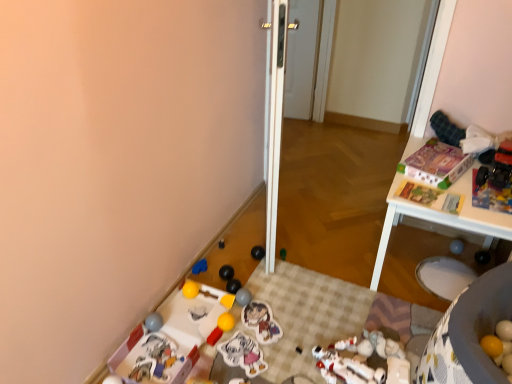
Question: From a real-world perspective, is matte gray ball at lower left, acting as the nineteenth toy starting from the right, positioned above or below yellow matte ball at lower right, the 17th toy positioned from the left?

Choices:
 (A) below
 (B) above

Answer: (A)

Question: Is matte gray ball at lower left, placed as the 1th toy when sorted from left to right, inside or outside of yellow matte ball at lower right, the 17th toy positioned from the left?

Choices:
 (A) inside
 (B) outside

Answer: (B)

Question: Estimate the real-world distances between objects in this image. Which object is closer to the white glossy screen door at center, the 2th screen door in the left-to-right sequence?

Choices:
 (A) matte cardboard box at upper right, the sixteenth toy when ordered from left to right
 (B) white glossy door at center, which is counted as the 2th screen door, starting from the back
 (C) white matte robot at lower center, which is the 5th toy from right to left
 (D) black rubber ball at lower center, placed as the seventh toy when sorted from left to right
 (E) gray rubber ball at lower right, placed as the nineteenth toy when sorted from left to right

Answer: (B)

Question: Which of these objects is positioned closest to the white plastic table at upper right?

Choices:
 (A) yellow matte toy at lower center, acting as the 12th toy starting from the right
 (B) white plastic toy at lower center, placed as the 14th toy when sorted from right to left
 (C) gray rubber ball at lower right, placed as the nineteenth toy when sorted from left to right
 (D) plastic toy at lower left, which is the 17th toy in right-to-left order
 (E) matte plastic sticker at center, placed as the 11th toy when sorted from left to right

Answer: (C)